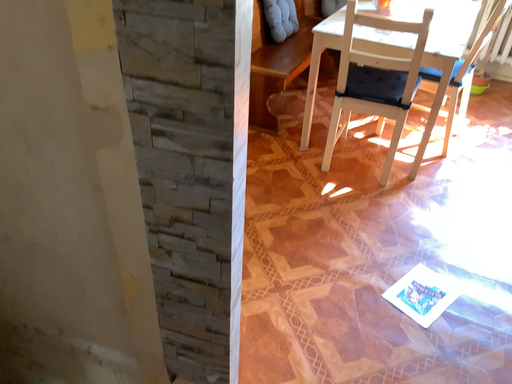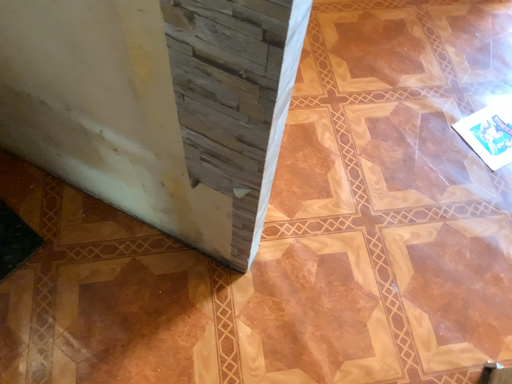
Question: Which way did the camera rotate in the video?

Choices:
 (A) rotated upward
 (B) rotated downward

Answer: (B)